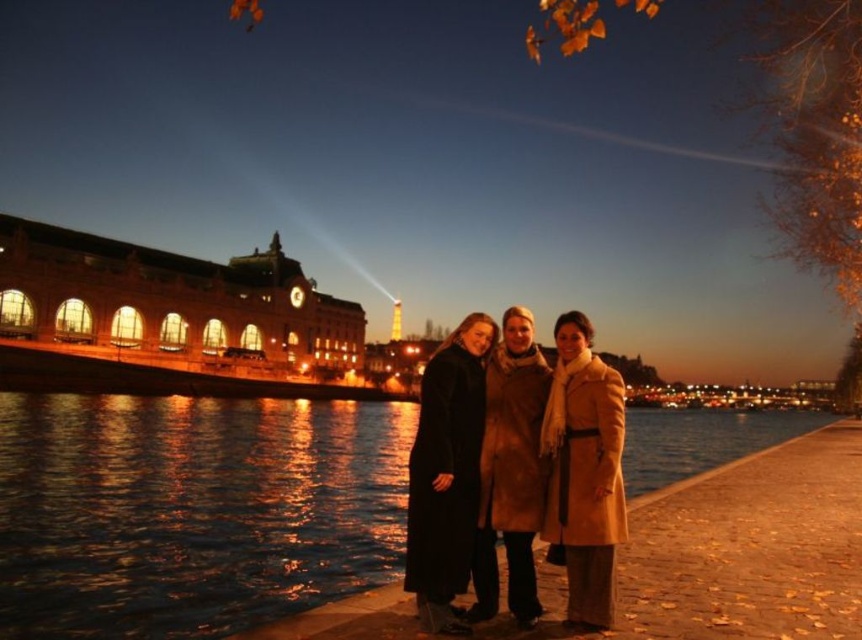
Question: Which point appears farthest from the camera in this image?

Choices:
 (A) (579, 440)
 (B) (517, 605)
 (C) (442, 595)

Answer: (A)

Question: Which of the following is the farthest from the observer?

Choices:
 (A) (497, 493)
 (B) (216, 483)
 (C) (489, 435)

Answer: (B)

Question: In this image, where is matte brown coat at center located relative to brown fur coat at center?

Choices:
 (A) above
 (B) below

Answer: (B)

Question: From the image, what is the correct spatial relationship of blue water at center in relation to beige wool coat at center?

Choices:
 (A) below
 (B) above

Answer: (A)

Question: Estimate the real-world distances between objects in this image. Which object is closer to the brown fur coat at center?

Choices:
 (A) blue water at center
 (B) black leather coat at center

Answer: (B)

Question: Is black leather coat at center positioned at the back of brown fur coat at center?

Choices:
 (A) yes
 (B) no

Answer: (B)